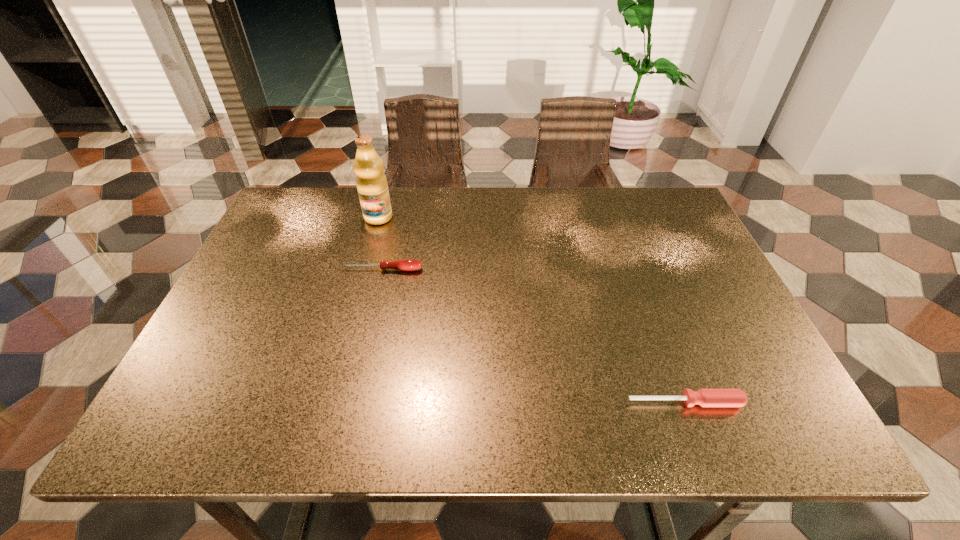
I want to click on object positioned at the near edge, so click(704, 397).

At what (x,y) coordinates should I click in order to perform the action: click on object located in the right edge section of the desktop. Please return your answer as a coordinate pair (x, y). The image size is (960, 540). Looking at the image, I should click on (704, 397).

Locate an element on the screen. object that is positioned at the near right corner is located at coordinates (704, 397).

The width and height of the screenshot is (960, 540). Find the location of `vacant point at the far edge`. vacant point at the far edge is located at coordinates (564, 210).

Locate an element on the screen. vacant area at the near edge of the desktop is located at coordinates (312, 426).

The width and height of the screenshot is (960, 540). In the image, there is a desktop. What are the coordinates of `vacant space at the left edge` in the screenshot? It's located at (282, 279).

In the image, there is a desktop. Where is `vacant region at the right edge`? vacant region at the right edge is located at coordinates (759, 365).

Identify the location of vacant space at the far right corner. (657, 216).

At what (x,y) coordinates should I click in order to perform the action: click on empty space that is in between the right screwdriver and the left screwdriver. Please return your answer as a coordinate pair (x, y). This screenshot has width=960, height=540. Looking at the image, I should click on (534, 336).

Where is `free area in between the second farthest object and the fruit juice`? free area in between the second farthest object and the fruit juice is located at coordinates (380, 244).